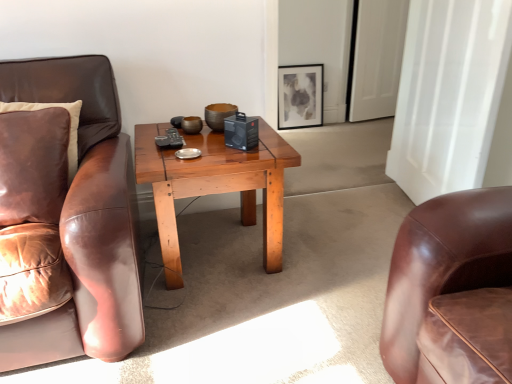
Question: From the image's perspective, is leather pillow at left above white glossy door at upper right?

Choices:
 (A) yes
 (B) no

Answer: (B)

Question: From the image's perspective, is leather pillow at left beneath white glossy door at upper right?

Choices:
 (A) yes
 (B) no

Answer: (A)

Question: Does leather pillow at left have a greater height compared to white glossy door at upper right?

Choices:
 (A) yes
 (B) no

Answer: (B)

Question: Is leather pillow at left facing towards white glossy door at upper right?

Choices:
 (A) no
 (B) yes

Answer: (A)

Question: Does leather pillow at left lie behind white glossy door at upper right?

Choices:
 (A) no
 (B) yes

Answer: (A)

Question: Is white glossy door at upper right inside the boundaries of leather pillow at left, or outside?

Choices:
 (A) outside
 (B) inside

Answer: (A)

Question: In the image, is white glossy door at upper right positioned in front of or behind leather pillow at left?

Choices:
 (A) behind
 (B) front

Answer: (A)

Question: From the image's perspective, relative to leather pillow at left, is white glossy door at upper right above or below?

Choices:
 (A) above
 (B) below

Answer: (A)

Question: Is white glossy door at upper right wider or thinner than leather pillow at left?

Choices:
 (A) wide
 (B) thin

Answer: (B)

Question: From a real-world perspective, relative to white glossy door at upper right, is wooden coffee table at center vertically above or below?

Choices:
 (A) below
 (B) above

Answer: (A)

Question: Considering the positions of wooden coffee table at center and white glossy door at upper right in the image, is wooden coffee table at center taller or shorter than white glossy door at upper right?

Choices:
 (A) short
 (B) tall

Answer: (A)

Question: Based on their positions, is wooden coffee table at center located to the left or right of white glossy door at upper right?

Choices:
 (A) right
 (B) left

Answer: (B)

Question: Is wooden coffee table at center bigger or smaller than white glossy door at upper right?

Choices:
 (A) big
 (B) small

Answer: (A)

Question: Based on their sizes in the image, would you say leather pillow at left is bigger or smaller than matte black picture frame at upper center?

Choices:
 (A) small
 (B) big

Answer: (B)

Question: In terms of width, does leather pillow at left look wider or thinner when compared to matte black picture frame at upper center?

Choices:
 (A) wide
 (B) thin

Answer: (A)